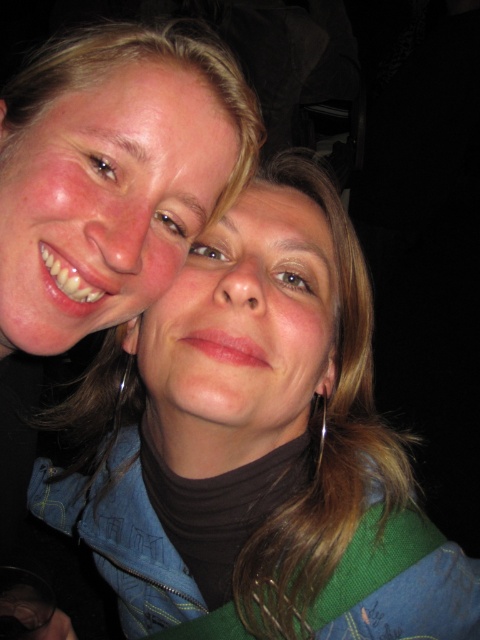
Question: Which point is closer to the camera?

Choices:
 (A) silver metallic earring at lower center
 (B) matte blue jacket at upper left

Answer: (B)

Question: Which point is farther to the camera?

Choices:
 (A) (145, 321)
 (B) (317, 467)

Answer: (B)

Question: Does matte blue jacket at upper left have a greater width compared to silver metallic earring at lower center?

Choices:
 (A) no
 (B) yes

Answer: (B)

Question: Does matte blue jacket at upper left appear on the left side of silver metallic earring at lower center?

Choices:
 (A) yes
 (B) no

Answer: (A)

Question: Can you confirm if matte blue jacket at upper left is bigger than silver metallic earring at lower center?

Choices:
 (A) no
 (B) yes

Answer: (B)

Question: Which point is farther to the camera?

Choices:
 (A) pos(383,592)
 (B) pos(324,442)

Answer: (B)